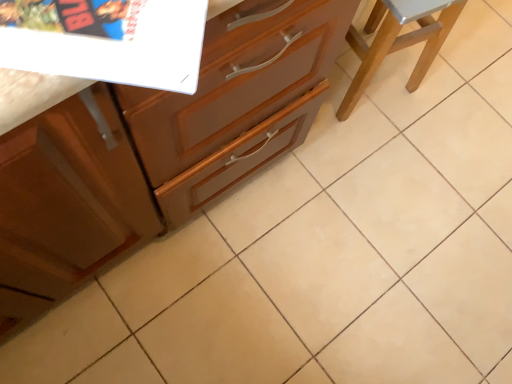
In order to click on blank area beneath wooden stool at right (from a real-world perspective) in this screenshot , I will do `click(376, 76)`.